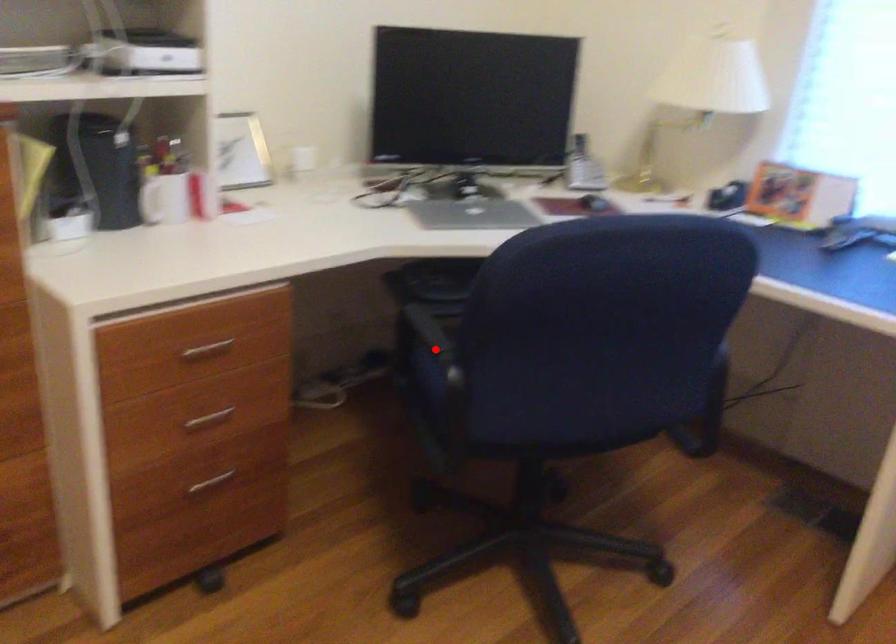
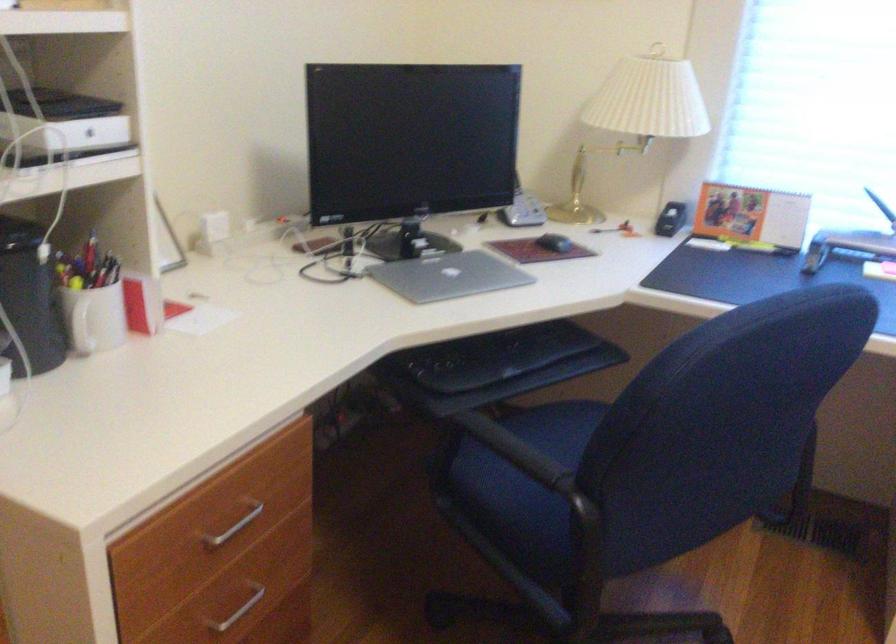
Question: I am providing you with two images of the same scene from different viewpoints. A red point is marked on the first image. Is the red point's position out of view in image 2?

Choices:
 (A) Yes
 (B) No

Answer: (B)